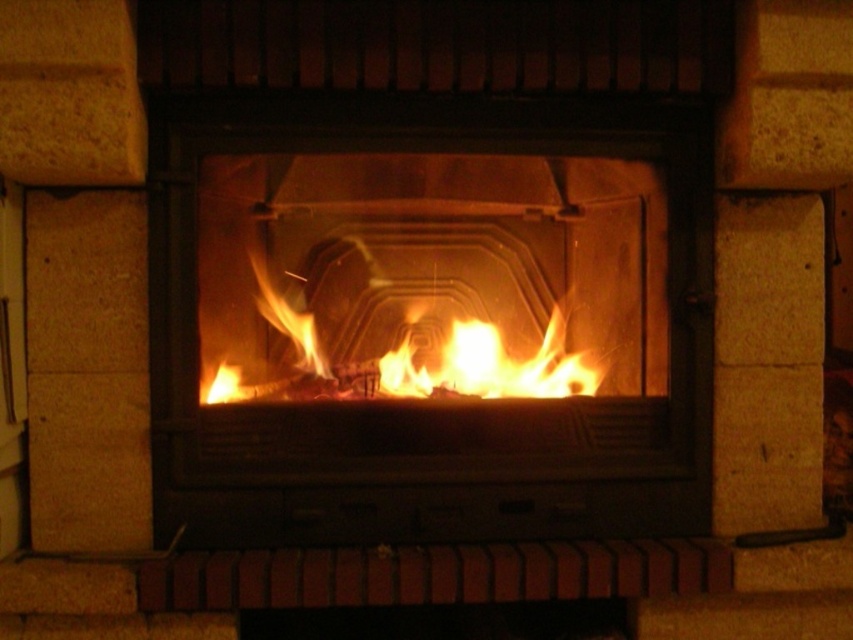
Question: Is matte black fireplace at center positioned in front of flametransparentfire at center?

Choices:
 (A) yes
 (B) no

Answer: (A)

Question: Can you confirm if matte black fireplace at center is positioned to the left of flametransparentfire at center?

Choices:
 (A) no
 (B) yes

Answer: (A)

Question: Is matte black fireplace at center behind flametransparentfire at center?

Choices:
 (A) yes
 (B) no

Answer: (B)

Question: Which point is closer to the camera?

Choices:
 (A) matte black fireplace at center
 (B) flametransparentfire at center

Answer: (A)